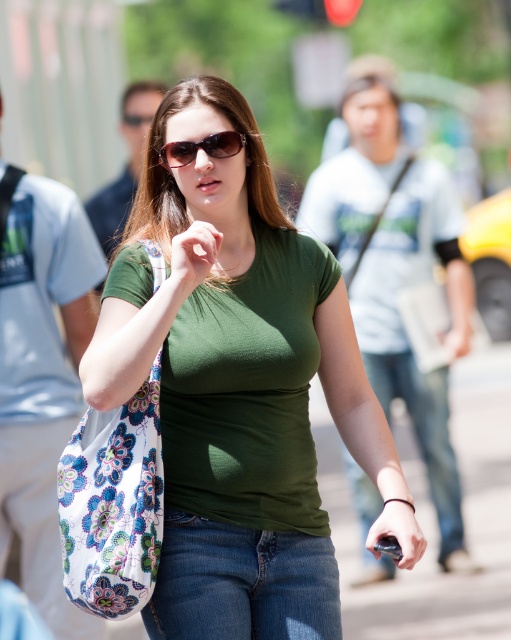
You are a fashion designer observing a model wearing a green matte shirt at center and matte black sunglasses at center. Which item has a greater width?

The green matte shirt at center has a greater width than the matte black sunglasses at center.